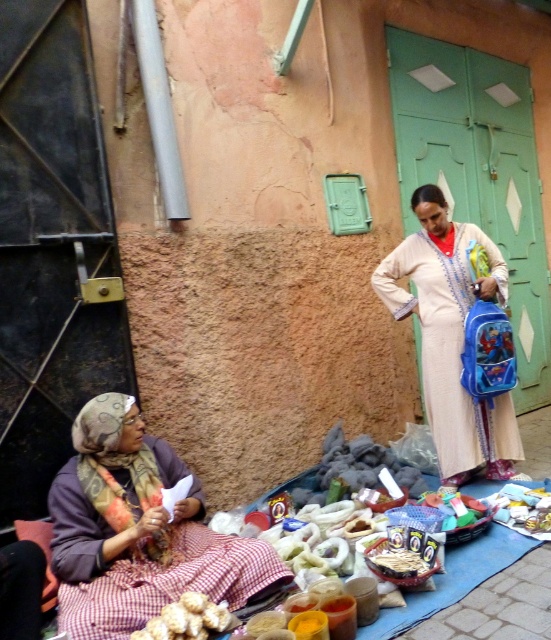
Is plaid fabric at lower left shorter than beige cotton dress at center?

Correct, plaid fabric at lower left is not as tall as beige cotton dress at center.

The height and width of the screenshot is (640, 551). Describe the element at coordinates (138, 531) in the screenshot. I see `plaid fabric at lower left` at that location.

Who is more forward, (160,477) or (417,289)?

Point (160,477) is in front.

Locate an element on the screen. Image resolution: width=551 pixels, height=640 pixels. plaid fabric at lower left is located at coordinates (138, 531).

Locate an element on the screen. plaid fabric at lower left is located at coordinates (138, 531).

Who is positioned more to the right, plaid fabric at lower left or white crumbly food at lower left?

From the viewer's perspective, white crumbly food at lower left appears more on the right side.

Does point (74, 490) lie behind point (186, 595)?

Yes, point (74, 490) is farther from viewer.

At what (x,y) coordinates should I click in order to perform the action: click on plaid fabric at lower left. Please return your answer as a coordinate pair (x, y). The image size is (551, 640). Looking at the image, I should click on (138, 531).

Who is positioned more to the right, beige cotton dress at center or white crumbly food at lower left?

beige cotton dress at center

Can you confirm if beige cotton dress at center is shorter than white crumbly food at lower left?

Incorrect, beige cotton dress at center's height does not fall short of white crumbly food at lower left's.

Between point (499, 426) and point (152, 625), which one is positioned in front?

Point (152, 625) is more forward.

Identify the location of beige cotton dress at center. (451, 337).